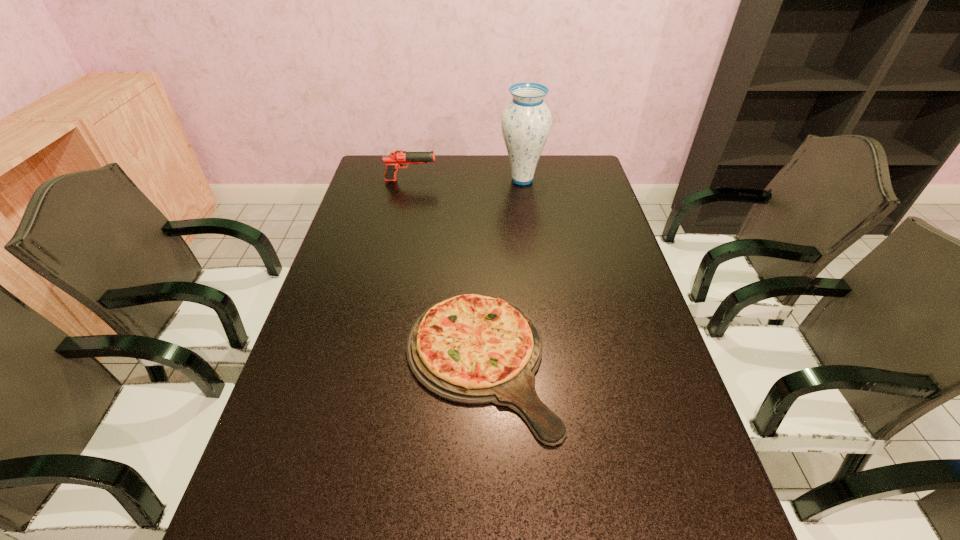
Image resolution: width=960 pixels, height=540 pixels. Find the location of `object located at the far left corner`. object located at the far left corner is located at coordinates (396, 159).

At what (x,y) coordinates should I click in order to perform the action: click on vacant area at the left edge of the desktop. Please return your answer as a coordinate pair (x, y). Looking at the image, I should click on (390, 220).

The height and width of the screenshot is (540, 960). In the image, there is a desktop. Identify the location of free region at the right edge. (575, 197).

The height and width of the screenshot is (540, 960). In order to click on vacant space at the far left corner of the desktop in this screenshot , I will do `click(372, 158)`.

Locate an element on the screen. vacant space at the far right corner of the desktop is located at coordinates coord(572,176).

Identify the location of free space between the gun and the shortest object. (445, 271).

Locate an element on the screen. The height and width of the screenshot is (540, 960). free area in between the second shortest object and the tallest object is located at coordinates (467, 180).

At what (x,y) coordinates should I click in order to perform the action: click on unoccupied area between the second shortest object and the tallest object. Please return your answer as a coordinate pair (x, y). Looking at the image, I should click on (467, 180).

Locate an element on the screen. The height and width of the screenshot is (540, 960). the second closest object to the second shortest object is located at coordinates (472, 349).

Select which object appears as the closest to the gun. Please provide its 2D coordinates. Your answer should be formatted as a tuple, i.e. [(x, y)], where the tuple contains the x and y coordinates of a point satisfying the conditions above.

[(526, 122)]